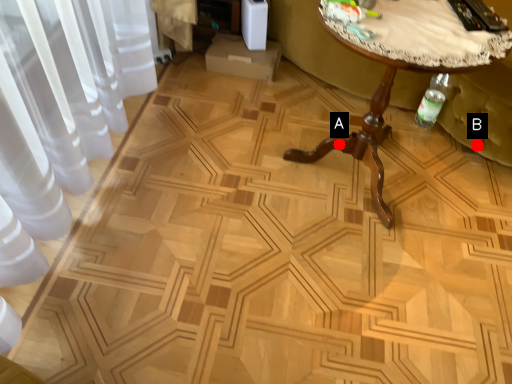
Question: Two points are circled on the image, labeled by A and B beside each circle. Which point appears farthest from the camera in this image?

Choices:
 (A) A is further
 (B) B is further

Answer: (B)